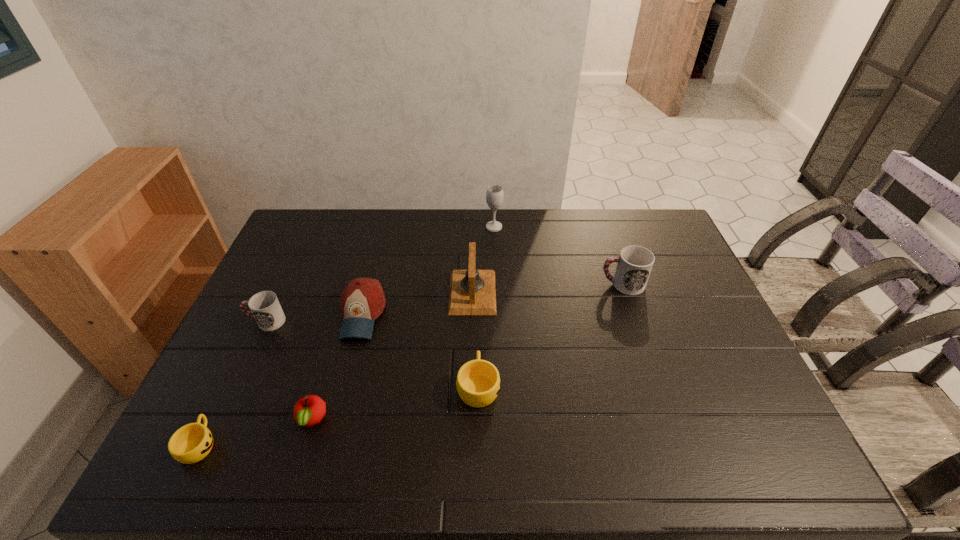
Point out which cup is positioned as the second nearest to the smaller red cup. Please provide its 2D coordinates. Your answer should be formatted as a tuple, i.e. [(x, y)], where the tuple contains the x and y coordinates of a point satisfying the conditions above.

[(478, 383)]

Identify the location of blank area in the image that satisfies the following two spatial constraints: 1. on the back side of the bell; 2. on the handle side of the farther red cup. (472, 284).

I want to click on free location that satisfies the following two spatial constraints: 1. on the handle side of the second tallest cup; 2. on the left side of the bell, so pyautogui.click(x=280, y=292).

You are a GUI agent. You are given a task and a screenshot of the screen. Output one action in this format:
    pyautogui.click(x=<x>, y=<y>)
    Task: Click on the free location that satisfies the following two spatial constraints: 1. on the back side of the bigger beige cup; 2. on the left side of the tallest object
    
    Given the screenshot: What is the action you would take?
    pyautogui.click(x=479, y=227)

This screenshot has height=540, width=960. I want to click on free location that satisfies the following two spatial constraints: 1. on the handle side of the bell; 2. on the right side of the third nearest cup, so click(280, 292).

What are the coordinates of `free space that satisfies the following two spatial constraints: 1. on the back side of the left beige cup; 2. on the handle side of the left red cup` in the screenshot? It's located at (259, 321).